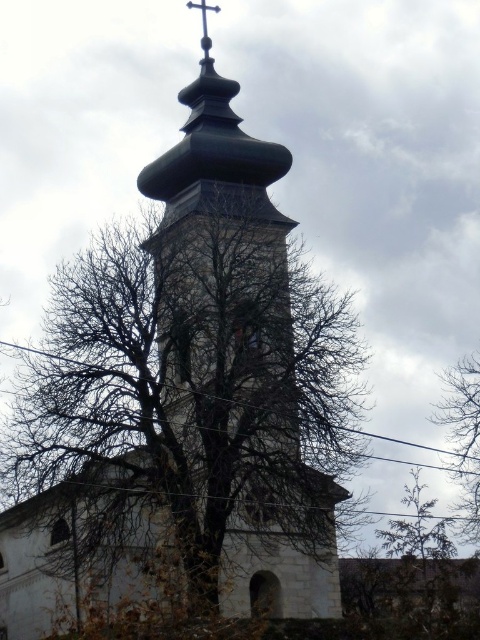
Question: Considering the real-world distances, which object is farthest from the metallic cross at upper center?

Choices:
 (A) brown leafy tree at upper right
 (B) bare branches at center
 (C) green stone tower at center
 (D) green textured tree at center

Answer: (D)

Question: Which of the following is the farthest from the observer?

Choices:
 (A) (264, 413)
 (B) (422, 524)
 (C) (477, 436)

Answer: (B)

Question: Which object appears closest to the camera in this image?

Choices:
 (A) brown leafy tree at upper right
 (B) green textured tree at center
 (C) metallic cross at upper center

Answer: (B)

Question: Can you confirm if bare branches at center is smaller than brown leafy tree at upper right?

Choices:
 (A) no
 (B) yes

Answer: (A)

Question: Is bare branches at center positioned before green stone tower at center?

Choices:
 (A) no
 (B) yes

Answer: (B)

Question: Does green stone tower at center appear under brown leafy tree at upper right?

Choices:
 (A) yes
 (B) no

Answer: (B)